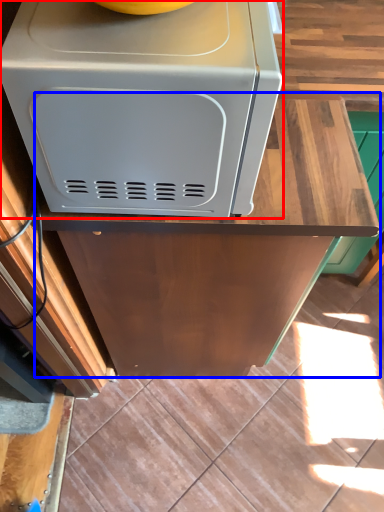
Question: Which object appears farthest to the camera in this image, home appliance (highlighted by a red box) or counter (highlighted by a blue box)?

Choices:
 (A) home appliance
 (B) counter

Answer: (B)